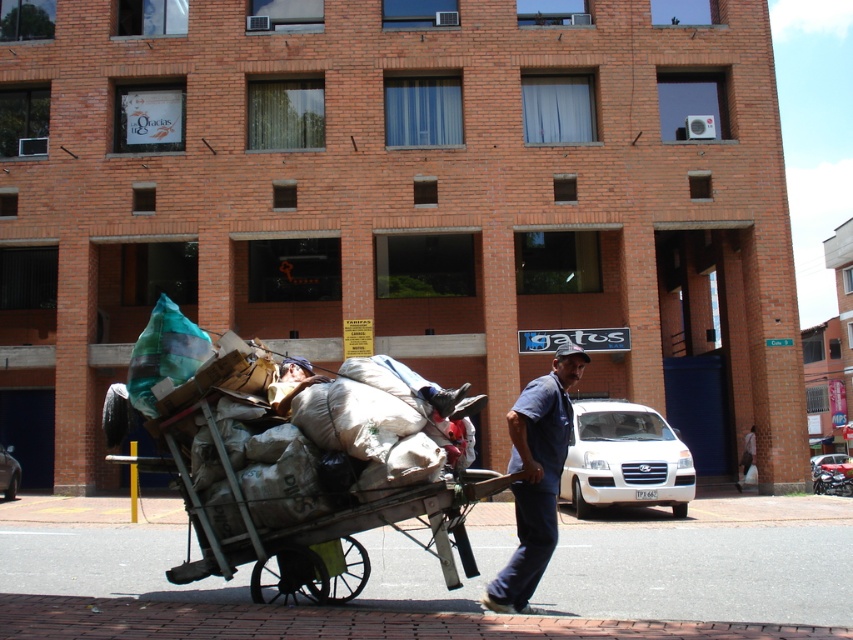
Is wooden cart at center thinner than blue denim shirt at center?

No, wooden cart at center is not thinner than blue denim shirt at center.

Consider the image. Does wooden cart at center appear over blue denim shirt at center?

Incorrect, wooden cart at center is not positioned above blue denim shirt at center.

This screenshot has width=853, height=640. I want to click on wooden cart at center, so click(x=315, y=477).

I want to click on wooden cart at center, so click(315, 477).